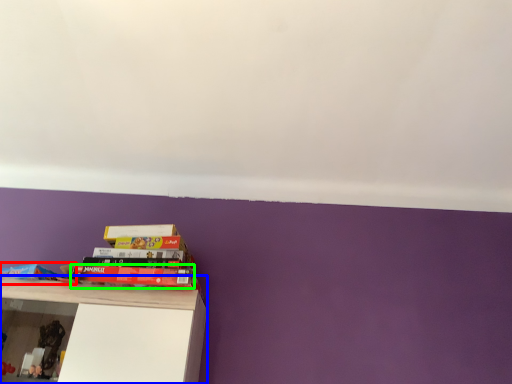
Question: Estimate the real-world distances between objects in this image. Which object is farther from book (highlighted by a red box), shelf (highlighted by a blue box) or book (highlighted by a green box)?

Choices:
 (A) shelf
 (B) book

Answer: (A)